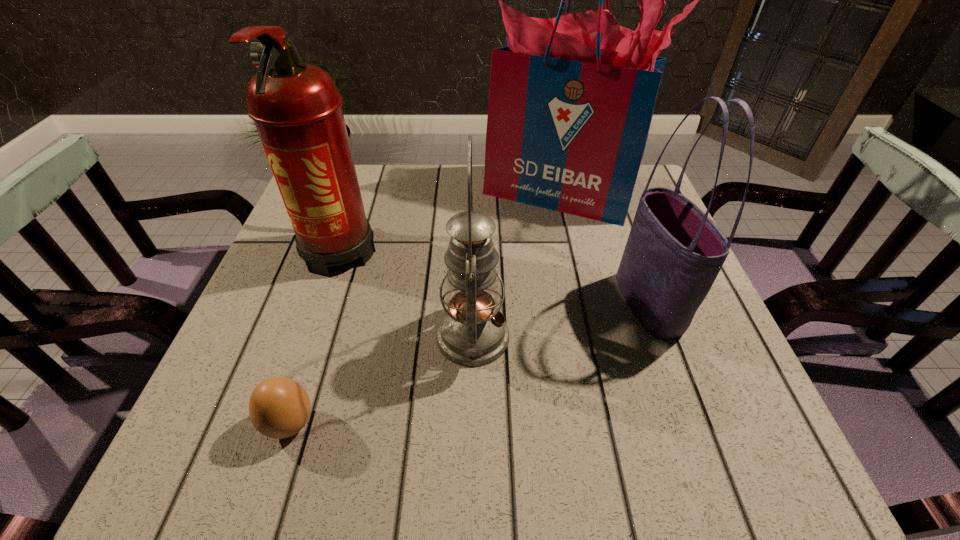
Where is `vacant space in between the oil lamp and the fire extinguisher`? Image resolution: width=960 pixels, height=540 pixels. vacant space in between the oil lamp and the fire extinguisher is located at coordinates (406, 292).

Locate an element on the screen. This screenshot has height=540, width=960. empty space that is in between the oil lamp and the grocery bag is located at coordinates (516, 265).

The width and height of the screenshot is (960, 540). I want to click on free space between the tote bag and the oil lamp, so [x=561, y=320].

Choose which object is the third nearest neighbor to the nearest object. Please provide its 2D coordinates. Your answer should be formatted as a tuple, i.e. [(x, y)], where the tuple contains the x and y coordinates of a point satisfying the conditions above.

[(571, 99)]

Select which object is the closest to the grocery bag. Please provide its 2D coordinates. Your answer should be formatted as a tuple, i.e. [(x, y)], where the tuple contains the x and y coordinates of a point satisfying the conditions above.

[(674, 252)]

The image size is (960, 540). Find the location of `vacant space that satisfies the following two spatial constraints: 1. on the back side of the tote bag; 2. on the left side of the oil lamp`. vacant space that satisfies the following two spatial constraints: 1. on the back side of the tote bag; 2. on the left side of the oil lamp is located at coordinates (473, 305).

I want to click on vacant space that satisfies the following two spatial constraints: 1. on the front-facing side of the oil lamp; 2. on the right side of the fire extinguisher, so click(x=310, y=336).

The width and height of the screenshot is (960, 540). I want to click on free space that satisfies the following two spatial constraints: 1. on the front-facing side of the tote bag; 2. on the left side of the fire extinguisher, so click(321, 305).